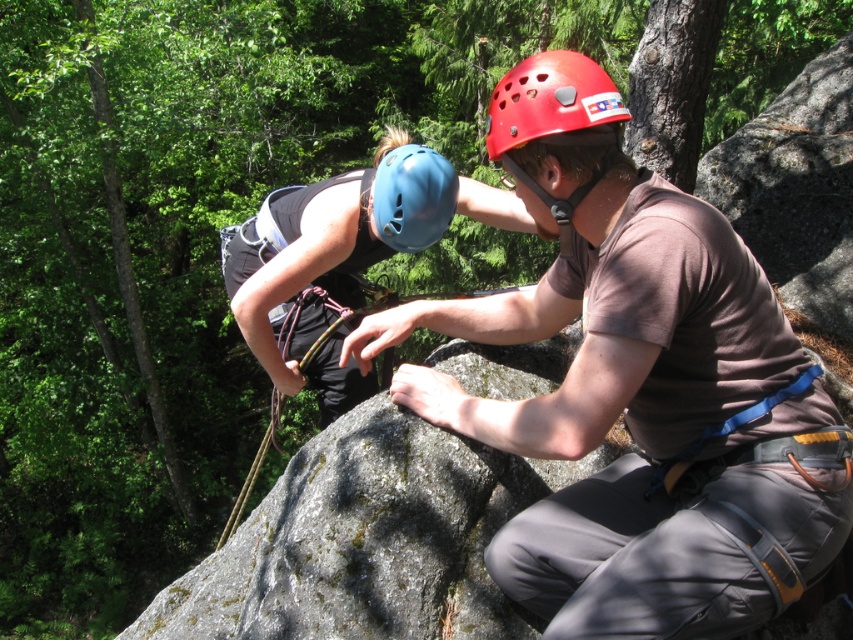
Who is shorter, matte brown shirt at center or blue matte helmet at center?

Standing shorter between the two is blue matte helmet at center.

Between point (821, 502) and point (448, 173), which one is positioned in front?

Positioned in front is point (821, 502).

The width and height of the screenshot is (853, 640). I want to click on matte brown shirt at center, so click(637, 388).

Looking at this image, is red matte helmet at center below blue matte helmet at center?

Incorrect, red matte helmet at center is not positioned below blue matte helmet at center.

Who is more distant from viewer, (486, 138) or (421, 173)?

Point (421, 173)

Locate an element on the screen. red matte helmet at center is located at coordinates (549, 100).

At what (x,y) coordinates should I click in order to perform the action: click on red matte helmet at center. Please return your answer as a coordinate pair (x, y). The height and width of the screenshot is (640, 853). Looking at the image, I should click on (549, 100).

Does matte brown shirt at center have a greater width compared to red matte helmet at center?

Yes.

Identify the location of matte brown shirt at center. (637, 388).

Identify the location of matte brown shirt at center. (637, 388).